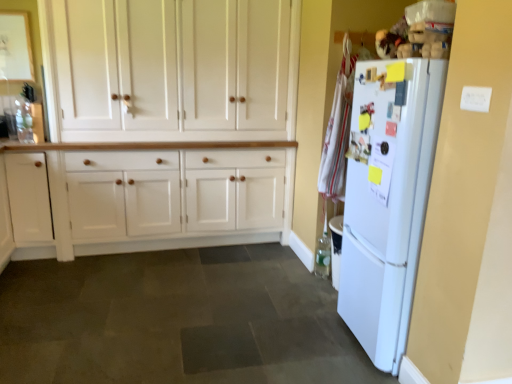
The width and height of the screenshot is (512, 384). What do you see at coordinates (167, 124) in the screenshot?
I see `white wood cabinet at center, which ranks as the first cabinetry in right-to-left order` at bounding box center [167, 124].

Where is `white wood cabinet at center, which ranks as the first cabinetry in right-to-left order`? This screenshot has width=512, height=384. white wood cabinet at center, which ranks as the first cabinetry in right-to-left order is located at coordinates (167, 124).

Is dark gray tile floor at center located within white wood cabinet at center, which appears as the 2th cabinetry when viewed from the left?

No.

From a real-world perspective, who is located lower, white wood cabinet at center, which appears as the 2th cabinetry when viewed from the left, or dark gray tile floor at center?

dark gray tile floor at center is physically lower.

From a real-world perspective, starting from the dark gray tile floor at center, which cabinetry is the 2nd one vertically above it? Please provide its 2D coordinates.

[(167, 124)]

Can you confirm if white wood cabinet at center, which ranks as the first cabinetry in right-to-left order, is shorter than dark gray tile floor at center?

In fact, white wood cabinet at center, which ranks as the first cabinetry in right-to-left order, may be taller than dark gray tile floor at center.

From the image's perspective, is white matte refrigerator at right above or below white wood cabinet at center, which ranks as the first cabinetry in right-to-left order?

Based on their image positions, white matte refrigerator at right is located beneath white wood cabinet at center, which ranks as the first cabinetry in right-to-left order.

This screenshot has width=512, height=384. In order to click on refrigerator that is in front of the white wood cabinet at center, which appears as the 2th cabinetry when viewed from the left in this screenshot , I will do [387, 199].

From a real-world perspective, relative to white wood cabinet at center, which ranks as the first cabinetry in right-to-left order, is white matte refrigerator at right vertically above or below?

In terms of real-world spatial position, white matte refrigerator at right is below white wood cabinet at center, which ranks as the first cabinetry in right-to-left order.

Based on their sizes in the image, would you say white matte refrigerator at right is bigger or smaller than white wood cabinet at center, which appears as the 2th cabinetry when viewed from the left?

In the image, white matte refrigerator at right appears to be smaller than white wood cabinet at center, which appears as the 2th cabinetry when viewed from the left.

Consider the image. Are white wood cabinet at left, which ranks as the first cabinetry in left-to-right order, and white wood cabinet at center, which appears as the 2th cabinetry when viewed from the left, located far from each other?

No, white wood cabinet at left, which ranks as the first cabinetry in left-to-right order, is not far from white wood cabinet at center, which appears as the 2th cabinetry when viewed from the left.

Based on the photo, between white wood cabinet at left, the 2th cabinetry when ordered from right to left, and white wood cabinet at center, which appears as the 2th cabinetry when viewed from the left, which one has larger size?

white wood cabinet at center, which appears as the 2th cabinetry when viewed from the left.

Is white wood cabinet at left, which ranks as the first cabinetry in left-to-right order, to the left or to the right of white wood cabinet at center, which appears as the 2th cabinetry when viewed from the left, in the image?

white wood cabinet at left, which ranks as the first cabinetry in left-to-right order, is positioned on white wood cabinet at center, which appears as the 2th cabinetry when viewed from the left,'s left side.

Is white matte refrigerator at right positioned far away from dark gray tile floor at center?

Actually, white matte refrigerator at right and dark gray tile floor at center are a little close together.

Is white matte refrigerator at right in front of or behind dark gray tile floor at center in the image?

In the image, white matte refrigerator at right appears behind dark gray tile floor at center.

How far apart are white matte refrigerator at right and dark gray tile floor at center?

They are 36.68 inches apart.

I want to click on refrigerator on the right of the dark gray tile floor at center, so click(x=387, y=199).

You are a GUI agent. You are given a task and a screenshot of the screen. Output one action in this format:
    pyautogui.click(x=<x>, y=<y>)
    Task: Click on the cabinetry directly beneath the white matte refrigerator at right (from a real-world perspective)
    This screenshot has width=512, height=384.
    Given the screenshot: What is the action you would take?
    29,197

Considering the sizes of objects white wood cabinet at left, which ranks as the first cabinetry in left-to-right order, and white matte refrigerator at right in the image provided, who is smaller, white wood cabinet at left, which ranks as the first cabinetry in left-to-right order, or white matte refrigerator at right?

With smaller size is white wood cabinet at left, which ranks as the first cabinetry in left-to-right order.

Does white wood cabinet at left, the 2th cabinetry when ordered from right to left, appear on the right side of white matte refrigerator at right?

No, white wood cabinet at left, the 2th cabinetry when ordered from right to left, is not to the right of white matte refrigerator at right.

Could you tell me if dark gray tile floor at center is turned towards white matte refrigerator at right?

No, dark gray tile floor at center does not turn towards white matte refrigerator at right.

Is dark gray tile floor at center next to white matte refrigerator at right?

No, dark gray tile floor at center is not making contact with white matte refrigerator at right.

Is point (228, 377) closer to viewer compared to point (384, 142)?

No, it is behind (384, 142).

Considering the relative positions of white wood cabinet at left, the 2th cabinetry when ordered from right to left, and dark gray tile floor at center in the image provided, is white wood cabinet at left, the 2th cabinetry when ordered from right to left, to the left or to the right of dark gray tile floor at center?

Based on their positions, white wood cabinet at left, the 2th cabinetry when ordered from right to left, is located to the left of dark gray tile floor at center.

Is white wood cabinet at left, which ranks as the first cabinetry in left-to-right order, not within dark gray tile floor at center?

white wood cabinet at left, which ranks as the first cabinetry in left-to-right order, is positioned outside dark gray tile floor at center.

Is white wood cabinet at left, which ranks as the first cabinetry in left-to-right order, closer to camera compared to dark gray tile floor at center?

No, white wood cabinet at left, which ranks as the first cabinetry in left-to-right order, is further to the viewer.

Is point (42, 216) less distant than point (80, 367)?

No, it is behind (80, 367).

Image resolution: width=512 pixels, height=384 pixels. What are the coordinates of `plain on the left of white wood cabinet at center, which ranks as the first cabinetry in right-to-left order` in the screenshot? It's located at (176, 320).

Locate an element on the screen. the 1st cabinetry behind when counting from the white matte refrigerator at right is located at coordinates (167, 124).

From the image, which object appears to be nearer to white matte refrigerator at right, white wood cabinet at center, which appears as the 2th cabinetry when viewed from the left, or white wood cabinet at left, the 2th cabinetry when ordered from right to left?

white wood cabinet at center, which appears as the 2th cabinetry when viewed from the left.

When comparing their distances from white wood cabinet at center, which appears as the 2th cabinetry when viewed from the left, does white matte refrigerator at right or white wood cabinet at left, the 2th cabinetry when ordered from right to left, seem closer?

white wood cabinet at left, the 2th cabinetry when ordered from right to left, is positioned closer to the anchor white wood cabinet at center, which appears as the 2th cabinetry when viewed from the left.

Based on their spatial positions, is white matte refrigerator at right or dark gray tile floor at center further from white wood cabinet at center, which appears as the 2th cabinetry when viewed from the left?

The object further to white wood cabinet at center, which appears as the 2th cabinetry when viewed from the left, is white matte refrigerator at right.

When comparing their distances from white matte refrigerator at right, does white wood cabinet at center, which ranks as the first cabinetry in right-to-left order, or dark gray tile floor at center seem further?

white wood cabinet at center, which ranks as the first cabinetry in right-to-left order, is further to white matte refrigerator at right.

When comparing their distances from white wood cabinet at left, the 2th cabinetry when ordered from right to left, does white wood cabinet at center, which appears as the 2th cabinetry when viewed from the left, or dark gray tile floor at center seem closer?

white wood cabinet at center, which appears as the 2th cabinetry when viewed from the left.

Considering their positions, is white wood cabinet at left, which ranks as the first cabinetry in left-to-right order, positioned closer to white matte refrigerator at right than dark gray tile floor at center?

dark gray tile floor at center is positioned closer to the anchor white matte refrigerator at right.

From the picture: Which object lies nearer to the anchor point dark gray tile floor at center, white matte refrigerator at right or white wood cabinet at center, which ranks as the first cabinetry in right-to-left order?

white matte refrigerator at right lies closer to dark gray tile floor at center than the other object.

Based on their spatial positions, is white wood cabinet at center, which ranks as the first cabinetry in right-to-left order, or white wood cabinet at left, which ranks as the first cabinetry in left-to-right order, closer to dark gray tile floor at center?

Among the two, white wood cabinet at left, which ranks as the first cabinetry in left-to-right order, is located nearer to dark gray tile floor at center.

Find the location of a particular element. The width and height of the screenshot is (512, 384). cabinetry between white wood cabinet at left, which ranks as the first cabinetry in left-to-right order, and white matte refrigerator at right is located at coordinates (167, 124).

This screenshot has width=512, height=384. I want to click on cabinetry between dark gray tile floor at center and white wood cabinet at left, the 2th cabinetry when ordered from right to left, from front to back, so click(x=167, y=124).

Locate an element on the screen. This screenshot has height=384, width=512. plain situated between white wood cabinet at left, which ranks as the first cabinetry in left-to-right order, and white matte refrigerator at right from left to right is located at coordinates (176, 320).

The width and height of the screenshot is (512, 384). What are the coordinates of `cabinetry located between dark gray tile floor at center and white matte refrigerator at right in the left-right direction` in the screenshot? It's located at (167, 124).